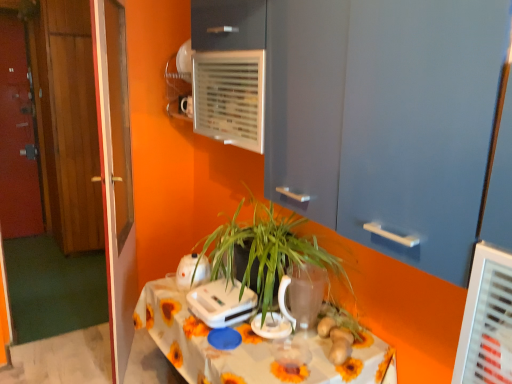
Find the location of `free point behind brown matte ginger at center`. free point behind brown matte ginger at center is located at coordinates (336, 331).